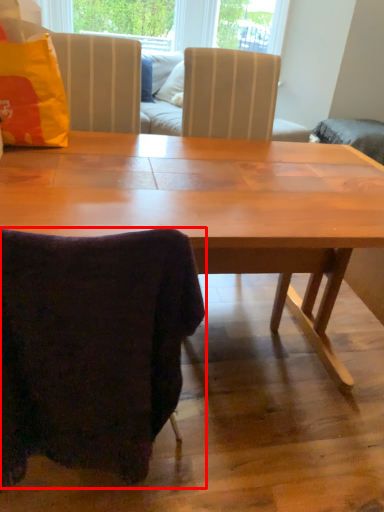
Question: From the image's perspective, where is chair (annotated by the red box) located in relation to pillow in the image?

Choices:
 (A) below
 (B) above

Answer: (A)